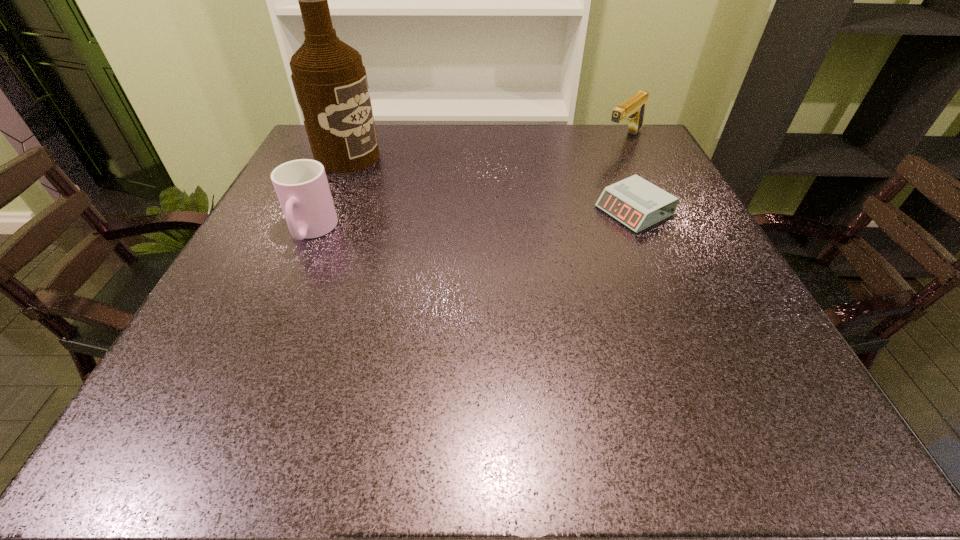
This screenshot has height=540, width=960. In order to click on vacant space located 0.080m on the label of the alcohol in this screenshot , I will do `click(395, 177)`.

Where is `vacant area situated on the label of the alcohol`? vacant area situated on the label of the alcohol is located at coordinates (388, 174).

I want to click on pistol that is positioned at the far edge, so click(633, 109).

Where is `alcohol present at the far edge`? The height and width of the screenshot is (540, 960). alcohol present at the far edge is located at coordinates (330, 82).

The height and width of the screenshot is (540, 960). Find the location of `cup at the left edge`. cup at the left edge is located at coordinates (302, 188).

Identify the location of alcohol present at the left edge. (330, 82).

Locate an element on the screen. The image size is (960, 540). alarm clock located at the right edge is located at coordinates (636, 203).

Find the location of a particular element. pistol that is at the right edge is located at coordinates click(x=633, y=109).

The height and width of the screenshot is (540, 960). I want to click on object present at the far left corner, so click(x=330, y=82).

You are a GUI agent. You are given a task and a screenshot of the screen. Output one action in this format:
    pyautogui.click(x=<x>, y=<y>)
    Task: Click on the object located in the far right corner section of the desktop
    
    Given the screenshot: What is the action you would take?
    pyautogui.click(x=633, y=109)